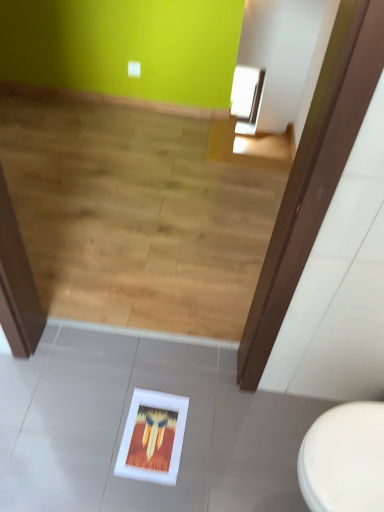
Measure the distance between point (154, 428) and camera.

Point (154, 428) and camera are 1.52 meters apart from each other.

Locate an element on the screen. white matte picture frame at lower center is located at coordinates (153, 437).

Which object is more forward, white matte picture frame at lower center or wooden floor at lower center?

white matte picture frame at lower center is more forward.

Locate an element on the screen. Image resolution: width=384 pixels, height=512 pixels. stairwell that is behind the white matte picture frame at lower center is located at coordinates (138, 213).

Considering the points (170, 444) and (111, 319), which point is behind, point (170, 444) or point (111, 319)?

The point (111, 319) is more distant.

From a real-world perspective, is white matte picture frame at lower center over wooden floor at lower center?

No, from a real-world perspective, white matte picture frame at lower center is not on top of wooden floor at lower center.

Is point (118, 131) in front of point (180, 432)?

No, (118, 131) is further to viewer.

Is white matte picture frame at lower center located within wooden floor at lower center?

No, white matte picture frame at lower center is located outside of wooden floor at lower center.

Is wooden floor at lower center far from white matte picture frame at lower center?

wooden floor at lower center is positioned a significant distance from white matte picture frame at lower center.

Considering the relative sizes of wooden floor at lower center and white matte picture frame at lower center in the image provided, is wooden floor at lower center bigger than white matte picture frame at lower center?

Yes, wooden floor at lower center is bigger than white matte picture frame at lower center.

Would you say white matte picture frame at lower center contains white glossy toilet at lower right?

No, white glossy toilet at lower right is not a part of white matte picture frame at lower center.

Is white matte picture frame at lower center positioned with its back to white glossy toilet at lower right?

No, white matte picture frame at lower center is not facing away from white glossy toilet at lower right.

From the image's perspective, which is above, white matte picture frame at lower center or white glossy toilet at lower right?

white matte picture frame at lower center, from the image's perspective.

Is white glossy toilet at lower right oriented away from wooden floor at lower center?

A: That's not correct — white glossy toilet at lower right is not looking away from wooden floor at lower center.

Which is more to the right, white glossy toilet at lower right or wooden floor at lower center?

white glossy toilet at lower right.

Considering the sizes of objects white glossy toilet at lower right and wooden floor at lower center in the image provided, who is smaller, white glossy toilet at lower right or wooden floor at lower center?

Smaller between the two is white glossy toilet at lower right.

In order to click on stairwell below the white glossy toilet at lower right (from a real-world perspective) in this screenshot , I will do `click(138, 213)`.

Considering the relative sizes of wooden floor at lower center and white glossy toilet at lower right in the image provided, is wooden floor at lower center wider than white glossy toilet at lower right?

Correct, the width of wooden floor at lower center exceeds that of white glossy toilet at lower right.

From the image's perspective, relative to white glossy toilet at lower right, is wooden floor at lower center above or below?

Clearly, from the image's perspective, wooden floor at lower center is above white glossy toilet at lower right.

From a real-world perspective, is white glossy toilet at lower right below white matte picture frame at lower center?

No, from a real-world perspective, white glossy toilet at lower right is not under white matte picture frame at lower center.

In terms of width, does white glossy toilet at lower right look wider or thinner when compared to white matte picture frame at lower center?

Clearly, white glossy toilet at lower right has more width compared to white matte picture frame at lower center.

In the image, is white glossy toilet at lower right positioned in front of or behind white matte picture frame at lower center?

white glossy toilet at lower right is positioned closer to the viewer than white matte picture frame at lower center.

Is white glossy toilet at lower right to the left of white matte picture frame at lower center from the viewer's perspective?

Incorrect, white glossy toilet at lower right is not on the left side of white matte picture frame at lower center.

Identify the location of stairwell that is above the white matte picture frame at lower center (from the image's perspective). The height and width of the screenshot is (512, 384). (138, 213).

Find the location of a particular element. The width and height of the screenshot is (384, 512). stairwell located on the left of white matte picture frame at lower center is located at coordinates (138, 213).

Estimate the real-world distances between objects in this image. Which object is closer to white matte picture frame at lower center, white glossy toilet at lower right or wooden floor at lower center?

white glossy toilet at lower right is positioned closer to the anchor white matte picture frame at lower center.

Based on their spatial positions, is white glossy toilet at lower right or white matte picture frame at lower center further from wooden floor at lower center?

The object further to wooden floor at lower center is white glossy toilet at lower right.

Looking at this image, from the image, which object appears to be nearer to white glossy toilet at lower right, white matte picture frame at lower center or wooden floor at lower center?

Based on the image, white matte picture frame at lower center appears to be nearer to white glossy toilet at lower right.

When comparing their distances from white glossy toilet at lower right, does wooden floor at lower center or white matte picture frame at lower center seem further?

wooden floor at lower center lies further to white glossy toilet at lower right than the other object.

From the picture: Based on their spatial positions, is wooden floor at lower center or white glossy toilet at lower right further from white matte picture frame at lower center?

Based on the image, wooden floor at lower center appears to be further to white matte picture frame at lower center.

Considering their positions, is white matte picture frame at lower center positioned further to wooden floor at lower center than white glossy toilet at lower right?

white glossy toilet at lower right is positioned further to the anchor wooden floor at lower center.

Identify the location of picture frame between wooden floor at lower center and white glossy toilet at lower right in the vertical direction. (153, 437).